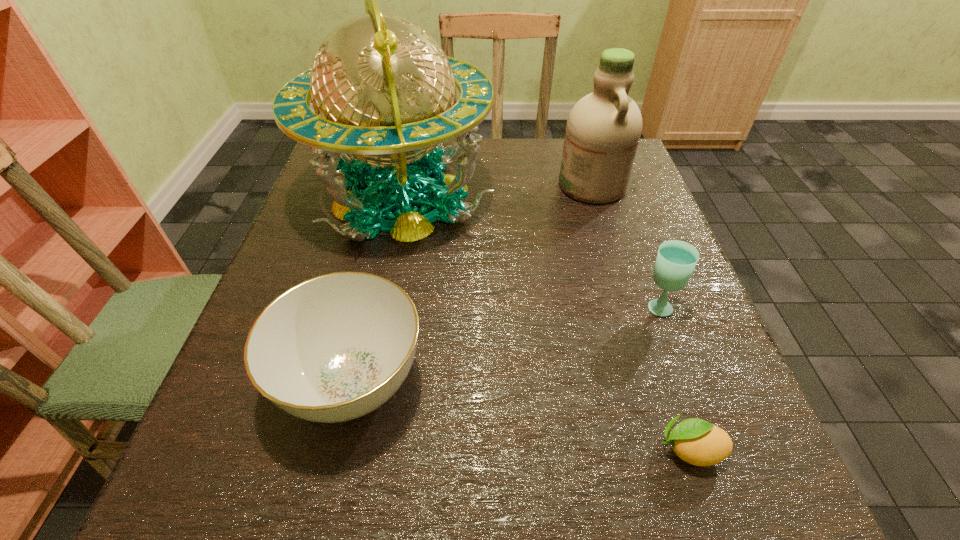
Identify the location of globe. The width and height of the screenshot is (960, 540). (383, 90).

The height and width of the screenshot is (540, 960). Find the location of `the fourth shortest object`. the fourth shortest object is located at coordinates tap(603, 130).

Identify the location of the third nearest object. The width and height of the screenshot is (960, 540). (676, 260).

Locate an element on the screen. The width and height of the screenshot is (960, 540). chinaware is located at coordinates (333, 348).

Locate an element on the screen. the shortest object is located at coordinates (698, 442).

Locate an element on the screen. The image size is (960, 540). vacant space located 0.180m on the front of the tallest object is located at coordinates (373, 333).

At what (x,y) coordinates should I click in order to perform the action: click on free spot located 0.290m on the front label of the cleansing agent. Please return your answer as a coordinate pair (x, y). This screenshot has width=960, height=540. Looking at the image, I should click on (441, 185).

The width and height of the screenshot is (960, 540). I want to click on vacant space located 0.350m on the front label of the cleansing agent, so click(x=416, y=185).

The image size is (960, 540). In order to click on vacant space located on the front label of the cleansing agent in this screenshot , I will do `click(396, 185)`.

Where is `free region located on the left of the third nearest object`? The width and height of the screenshot is (960, 540). free region located on the left of the third nearest object is located at coordinates (564, 306).